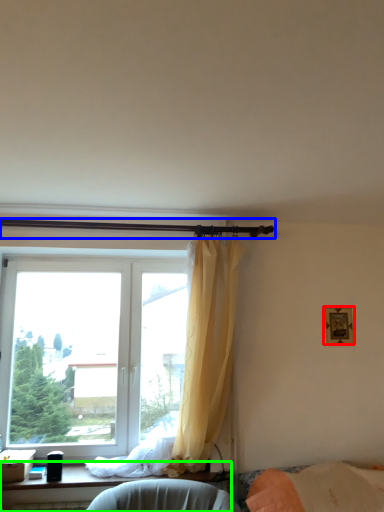
Question: Which object is positioned closest to picture frame (highlighted by a red box)? Select from beam (highlighted by a blue box) and furniture (highlighted by a green box).

Choices:
 (A) beam
 (B) furniture

Answer: (A)